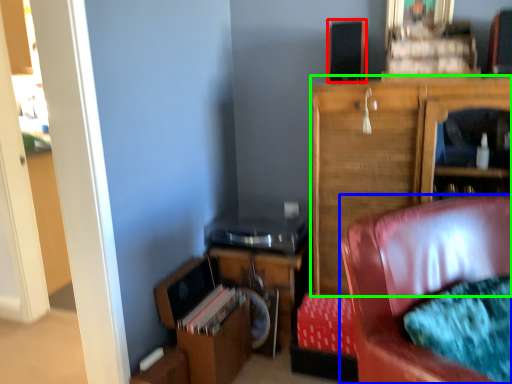
Question: Which object is the farthest from speaker (highlighted by a red box)? Choose among these: chair (highlighted by a blue box) or cabinetry (highlighted by a green box).

Choices:
 (A) chair
 (B) cabinetry

Answer: (A)